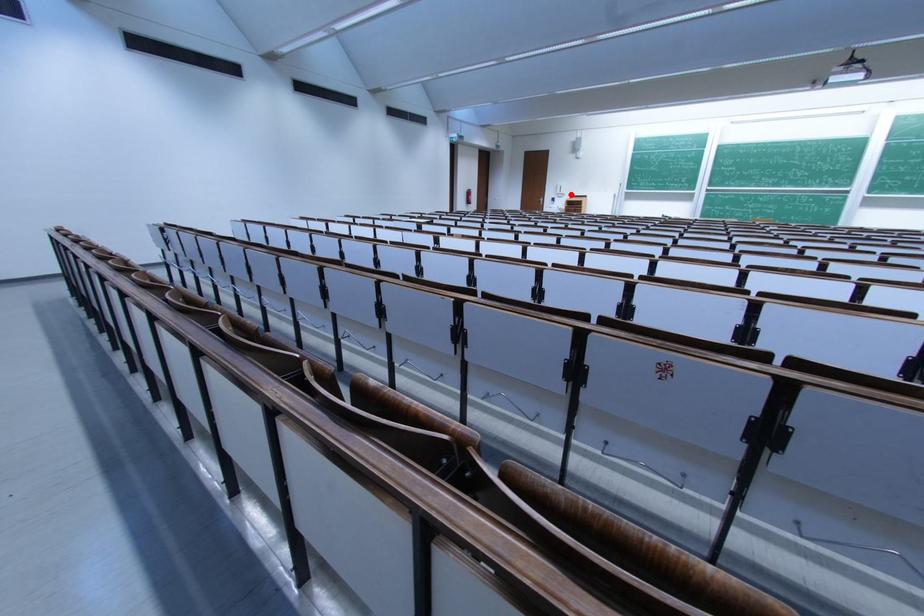
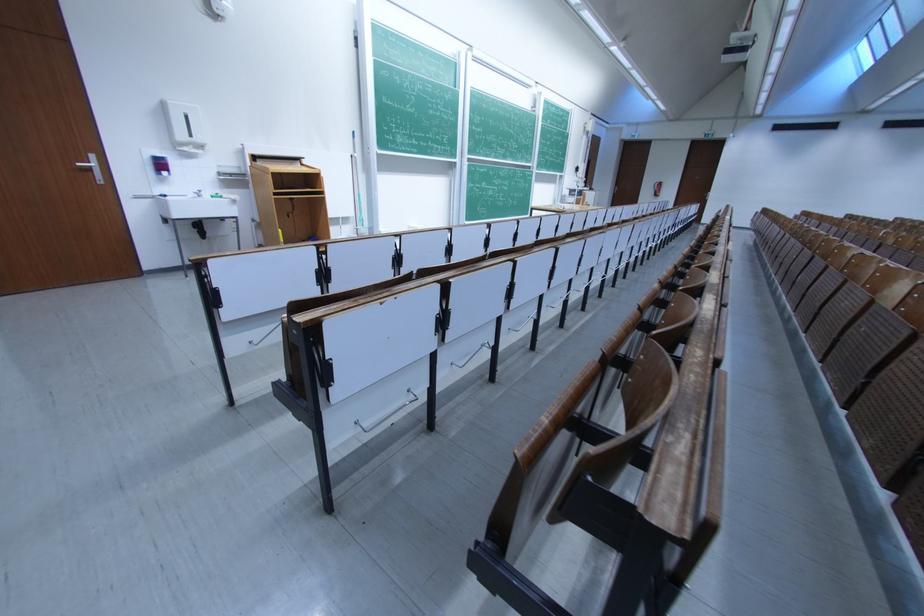
The point at the highlighted location is marked in the first image. Where is the corresponding point in the second image?

(205, 142)